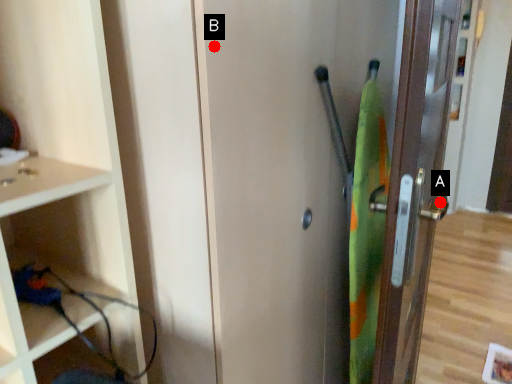
Question: Two points are circled on the image, labeled by A and B beside each circle. Which of the following is the closest to the observer?

Choices:
 (A) A is closer
 (B) B is closer

Answer: (B)